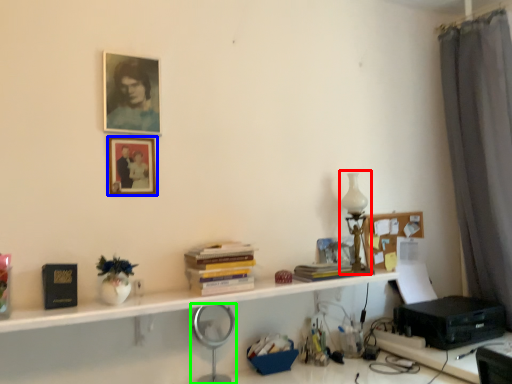
Question: Which object is positioned farthest from table lamp (highlighted by a red box)? Select from picture frame (highlighted by a blue box) and magnifying glass (highlighted by a green box).

Choices:
 (A) picture frame
 (B) magnifying glass

Answer: (A)